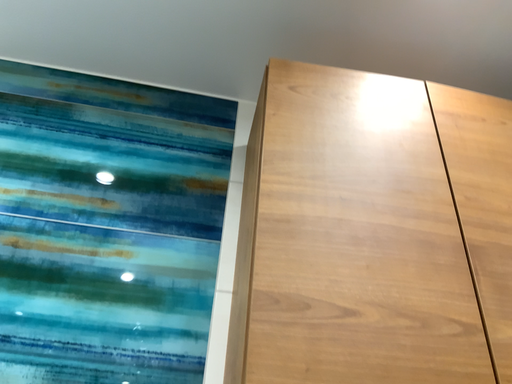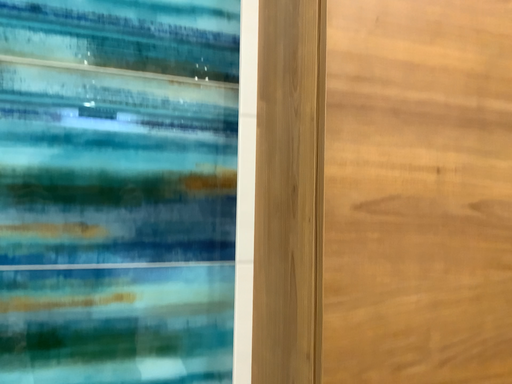
Question: How did the camera likely rotate when shooting the video?

Choices:
 (A) rotated downward
 (B) rotated upward

Answer: (A)